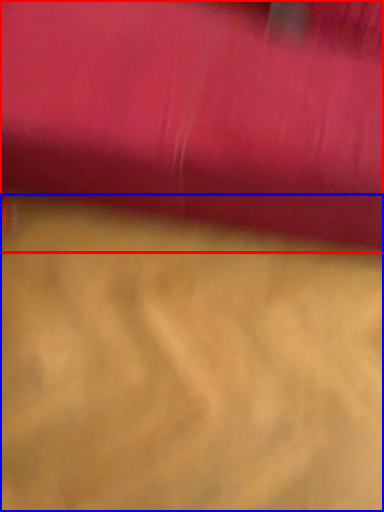
Question: Among these objects, which one is farthest to the camera, curtain (highlighted by a red box) or surface (highlighted by a blue box)?

Choices:
 (A) curtain
 (B) surface

Answer: (B)